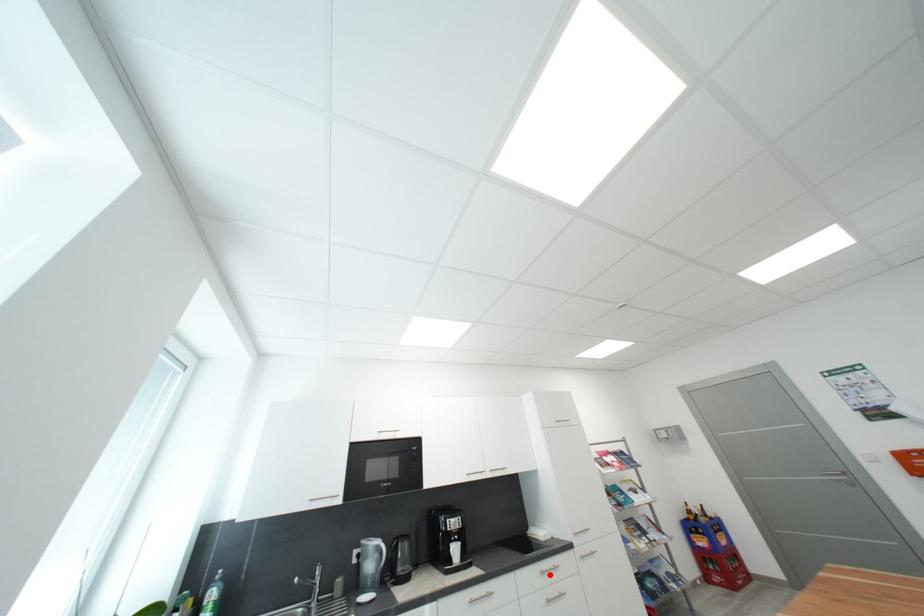
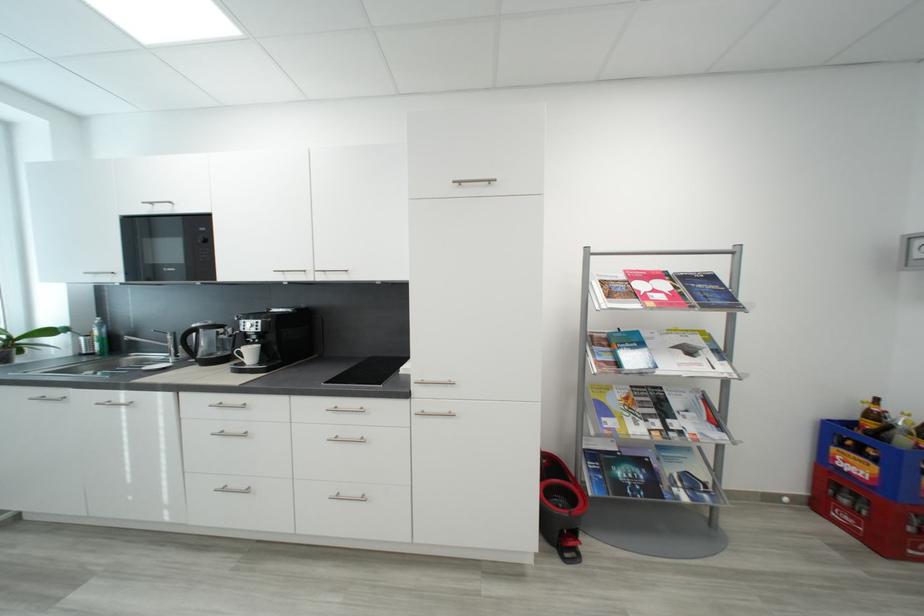
Where in the second image is the point corresponding to the highlighted location from the first image?

(343, 411)